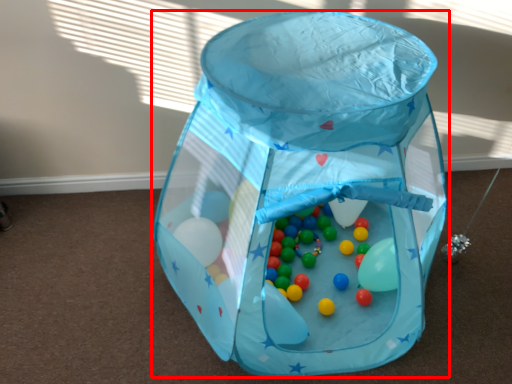
Question: From the image's perspective, what is the correct spatial positioning of baby carriage (annotated by the red box) in reference to toy?

Choices:
 (A) below
 (B) above

Answer: (B)